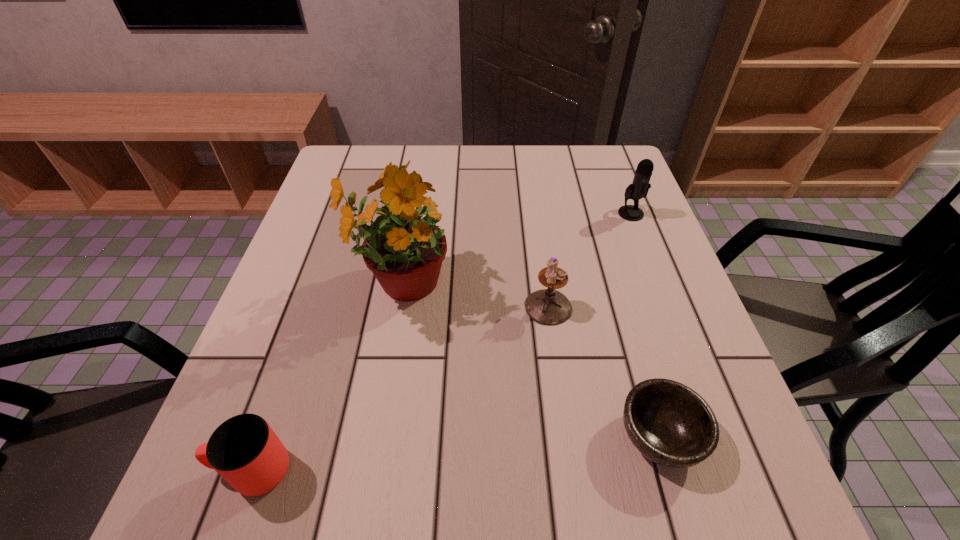
I want to click on free space at the near edge of the desktop, so click(401, 499).

Identify the location of vacant space at the left edge of the desktop. This screenshot has height=540, width=960. (310, 263).

At what (x,y) coordinates should I click in order to perform the action: click on free spot at the right edge of the desktop. Please return your answer as a coordinate pair (x, y). Looking at the image, I should click on (716, 414).

At what (x,y) coordinates should I click in order to perform the action: click on free space at the far left corner of the desktop. Please return your answer as a coordinate pair (x, y). Looking at the image, I should click on (353, 174).

Where is `vacant space at the near left corner of the desktop`? This screenshot has height=540, width=960. vacant space at the near left corner of the desktop is located at coordinates (251, 502).

Locate an element on the screen. The height and width of the screenshot is (540, 960). vacant space at the near right corner of the desktop is located at coordinates (675, 510).

The image size is (960, 540). In order to click on unoccupied area between the shortest object and the farthest object in this screenshot , I will do `click(645, 325)`.

You are a GUI agent. You are given a task and a screenshot of the screen. Output one action in this format:
    pyautogui.click(x=<x>, y=<y>)
    Task: Click on the free space between the flowerpot and the microphone
    
    Given the screenshot: What is the action you would take?
    pyautogui.click(x=516, y=249)

The width and height of the screenshot is (960, 540). What are the coordinates of `empty space that is in between the third object from right to left and the second object from left to right` in the screenshot? It's located at (474, 296).

This screenshot has height=540, width=960. Find the location of `free space between the bowl and the third object from left to right`. free space between the bowl and the third object from left to right is located at coordinates (604, 372).